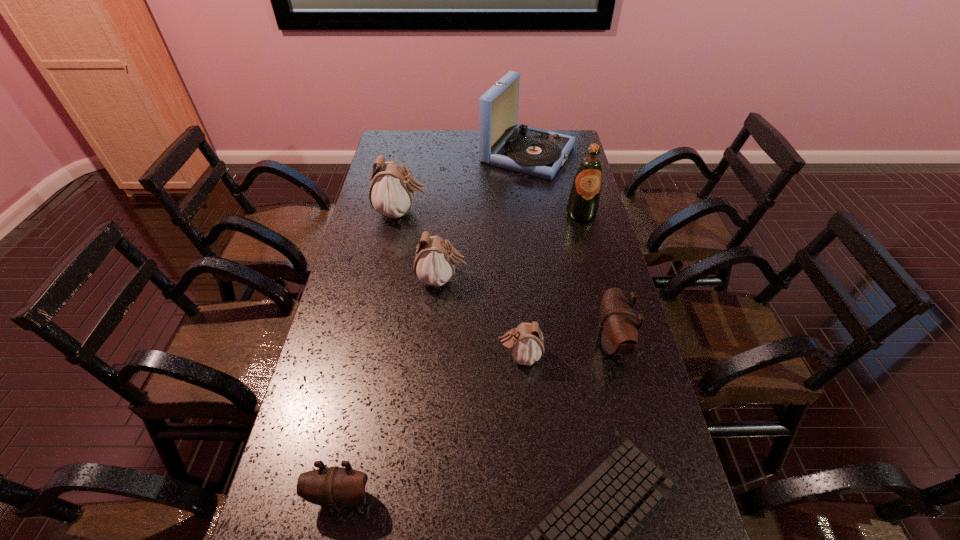
The width and height of the screenshot is (960, 540). Identify the location of vacant position in the image that satisfies the following two spatial constraints: 1. on the front-facing side of the second nearest white pouch; 2. with the flap open on the nearest pouch. (424, 497).